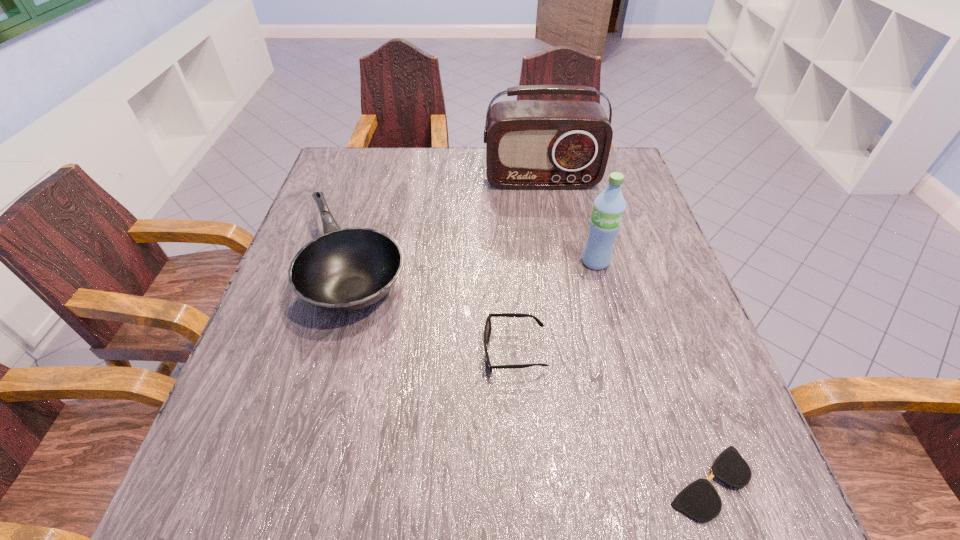
The width and height of the screenshot is (960, 540). I want to click on empty space that is in between the frying pan and the nearest object, so click(533, 375).

Locate an element on the screen. free area in between the radio receiver and the sunglasses is located at coordinates pos(528,265).

Locate an element on the screen. The width and height of the screenshot is (960, 540). free space between the fourth tallest object and the water bottle is located at coordinates (555, 306).

You are a GUI agent. You are given a task and a screenshot of the screen. Output one action in this format:
    pyautogui.click(x=<x>, y=<y>)
    Task: Click on the vacant area that lies between the spectacles and the water bottle
    
    Given the screenshot: What is the action you would take?
    pyautogui.click(x=652, y=372)

Where is `free space between the second shortest object and the leftmost object`? This screenshot has width=960, height=540. free space between the second shortest object and the leftmost object is located at coordinates tap(435, 309).

The image size is (960, 540). I want to click on vacant point located between the shortest object and the water bottle, so click(x=652, y=372).

I want to click on free space between the leftmost object and the radio receiver, so click(449, 224).

Where is `object that stands as the closest to the leftmost object`? object that stands as the closest to the leftmost object is located at coordinates (487, 329).

Where is `the third closest object relative to the frying pan`? the third closest object relative to the frying pan is located at coordinates (609, 206).

This screenshot has height=540, width=960. I want to click on vacant space that satisfies the following two spatial constraints: 1. on the front panel of the shortest object; 2. on the right side of the radio receiver, so click(x=593, y=483).